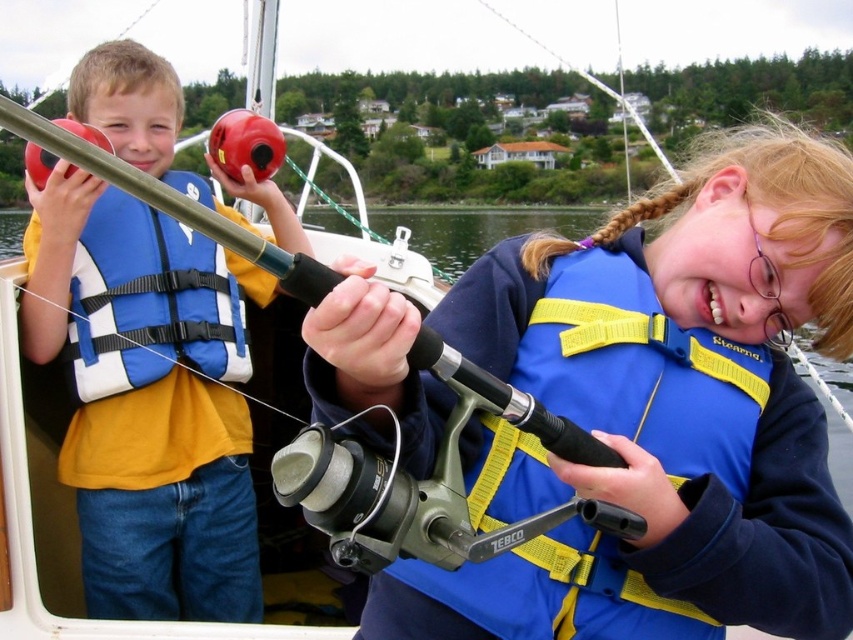
Who is positioned more to the left, matte plastic fishing rod at left or blue/yellow fabric life vest at center?

Positioned to the left is matte plastic fishing rod at left.

Is matte plastic fishing rod at left wider than blue/yellow fabric life vest at center?

Incorrect, matte plastic fishing rod at left's width does not surpass blue/yellow fabric life vest at center's.

The height and width of the screenshot is (640, 853). What are the coordinates of `matte plastic fishing rod at left` in the screenshot? It's located at (x=149, y=401).